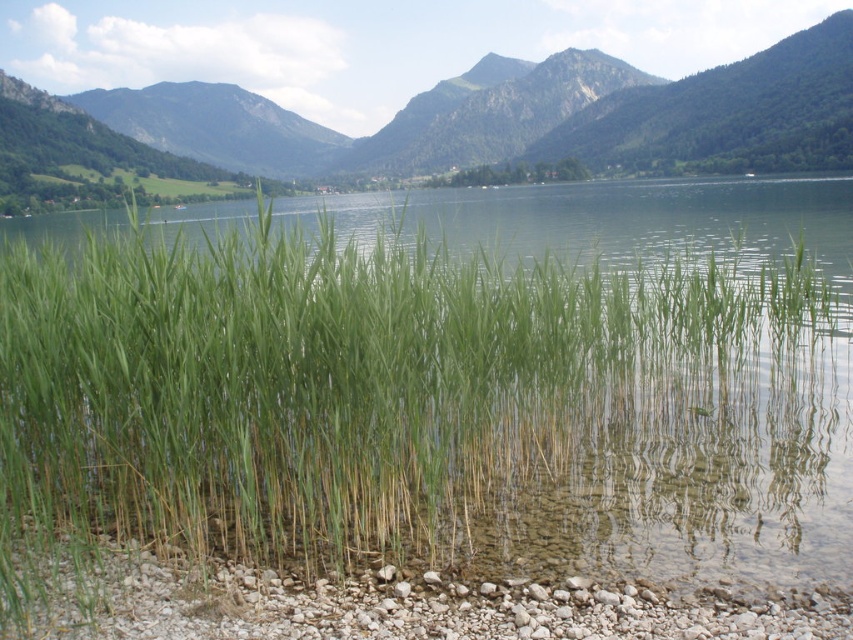
Question: Can you confirm if green grass at center is positioned to the left of green leafy vegetation at center?

Choices:
 (A) no
 (B) yes

Answer: (B)

Question: Is green leafy vegetation at center to the right of smooth pebbles at lower center from the viewer's perspective?

Choices:
 (A) no
 (B) yes

Answer: (A)

Question: Among these points, which one is farthest from the camera?

Choices:
 (A) (67, 250)
 (B) (85, 26)

Answer: (B)

Question: Does green leafy vegetation at center have a lesser width compared to smooth pebbles at lower center?

Choices:
 (A) yes
 (B) no

Answer: (B)

Question: Which point is closer to the camera?

Choices:
 (A) green leafy vegetation at center
 (B) green grass at center

Answer: (B)

Question: Among these objects, which one is farthest from the camera?

Choices:
 (A) green grass at center
 (B) green leafy vegetation at center
 (C) smooth pebbles at lower center

Answer: (B)